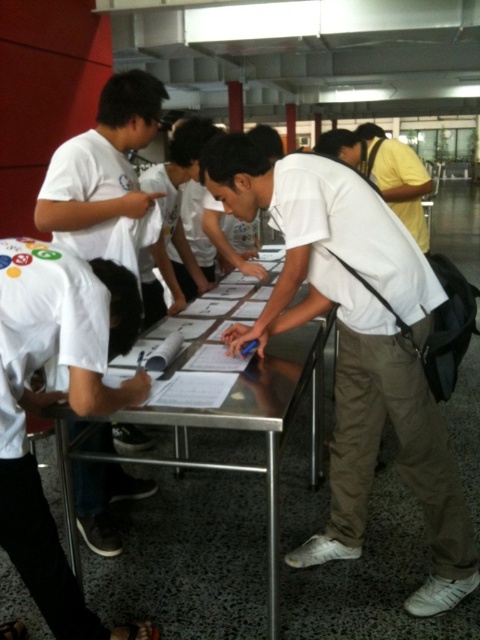
Question: Which point is closer to the camera?

Choices:
 (A) (409, 156)
 (B) (457, 536)
 (C) (32, 268)

Answer: (C)

Question: Which object appears closest to the camera in this image?

Choices:
 (A) white matte shirt at left
 (B) white matte shirt at center
 (C) white matte shirt at lower left

Answer: (C)

Question: Where is white matte shirt at center located in relation to metallic silver table at center in the image?

Choices:
 (A) right
 (B) left

Answer: (A)

Question: Does white matte shirt at center appear over white matte shirt at lower left?

Choices:
 (A) yes
 (B) no

Answer: (A)

Question: Which point appears closest to the camera in this image?

Choices:
 (A) (122, 129)
 (B) (410, 168)
 (C) (276, 515)

Answer: (C)

Question: Is white matte shirt at center positioned in front of yellow cotton shirt at upper right?

Choices:
 (A) no
 (B) yes

Answer: (B)